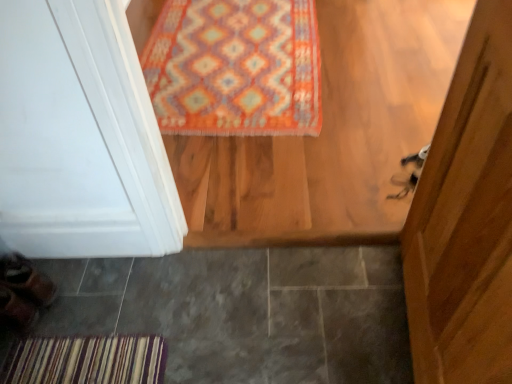
Question: Is leather brown shoe at lower left, the 1th shoe ordered from the bottom, closer to camera compared to gray tile at lower left?

Choices:
 (A) no
 (B) yes

Answer: (A)

Question: From the image's perspective, is leather brown shoe at lower left, the 1th shoe ordered from the bottom, below gray tile at lower left?

Choices:
 (A) no
 (B) yes

Answer: (A)

Question: Would you say leather brown shoe at lower left, the 1th shoe ordered from the bottom, contains gray tile at lower left?

Choices:
 (A) yes
 (B) no

Answer: (B)

Question: Is leather brown shoe at lower left, the 1th shoe ordered from the bottom, oriented towards gray tile at lower left?

Choices:
 (A) no
 (B) yes

Answer: (A)

Question: Is leather brown shoe at lower left, the 1th shoe ordered from the bottom, turned away from gray tile at lower left?

Choices:
 (A) no
 (B) yes

Answer: (B)

Question: Is point (20, 254) positioned closer to the camera than point (327, 266)?

Choices:
 (A) closer
 (B) farther

Answer: (B)

Question: Is brown leather shoe at lower left, the second shoe from the bottom, inside or outside of gray tile at lower left?

Choices:
 (A) inside
 (B) outside

Answer: (B)

Question: Considering their positions, is brown leather shoe at lower left, which is the first shoe from top to bottom, located in front of or behind gray tile at lower left?

Choices:
 (A) front
 (B) behind

Answer: (B)

Question: From the image's perspective, is brown leather shoe at lower left, the second shoe from the bottom, above or below gray tile at lower left?

Choices:
 (A) above
 (B) below

Answer: (A)

Question: Is brown leather shoe at lower left, which is the first shoe from top to bottom, in front of or behind multicolored woven rug at upper center in the image?

Choices:
 (A) front
 (B) behind

Answer: (A)

Question: In terms of height, does brown leather shoe at lower left, the second shoe from the bottom, look taller or shorter compared to multicolored woven rug at upper center?

Choices:
 (A) tall
 (B) short

Answer: (A)

Question: In the image, is brown leather shoe at lower left, which is the first shoe from top to bottom, on the left side or the right side of multicolored woven rug at upper center?

Choices:
 (A) left
 (B) right

Answer: (A)

Question: Based on their sizes in the image, would you say brown leather shoe at lower left, the second shoe from the bottom, is bigger or smaller than multicolored woven rug at upper center?

Choices:
 (A) small
 (B) big

Answer: (A)

Question: Is point (329, 283) positioned closer to the camera than point (234, 64)?

Choices:
 (A) closer
 (B) farther

Answer: (A)

Question: Considering the positions of gray tile at lower left and multicolored woven rug at upper center in the image, is gray tile at lower left wider or thinner than multicolored woven rug at upper center?

Choices:
 (A) thin
 (B) wide

Answer: (B)